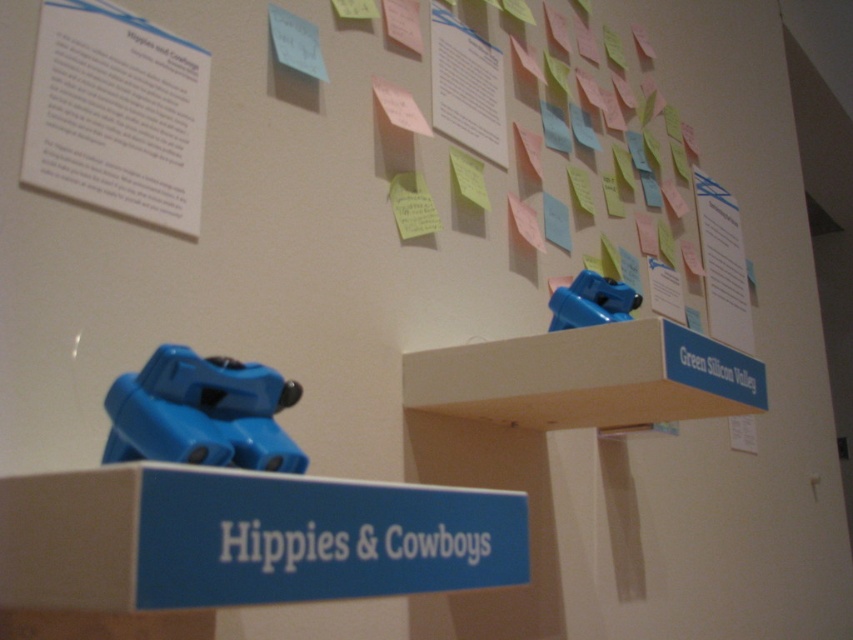
Measure the distance between white wood shelf at upper center and camera.

white wood shelf at upper center is 30.25 inches from camera.

At what (x,y) coordinates should I click in order to perform the action: click on white wood shelf at upper center. Please return your answer as a coordinate pair (x, y). Looking at the image, I should click on (587, 378).

Between white wood shelf at upper center and white matte sign at center, which one is positioned lower?

white matte sign at center is below.

Can you confirm if white wood shelf at upper center is positioned to the left of white matte sign at center?

No, white wood shelf at upper center is not to the left of white matte sign at center.

Which is in front, point (579, 404) or point (474, 541)?

Point (474, 541) is in front.

At what (x,y) coordinates should I click in order to perform the action: click on white wood shelf at upper center. Please return your answer as a coordinate pair (x, y). Looking at the image, I should click on (587, 378).

Is blue plastic sign at center taller than green matte sign at upper right?

Yes.

Is point (67, 557) positioned behind point (753, 364)?

No, it is in front of (753, 364).

Looking at this image, measure the distance between point (x=123, y=532) and camera.

Point (x=123, y=532) and camera are 38.94 centimeters apart from each other.

Where is `blue plastic sign at center`? blue plastic sign at center is located at coordinates (245, 538).